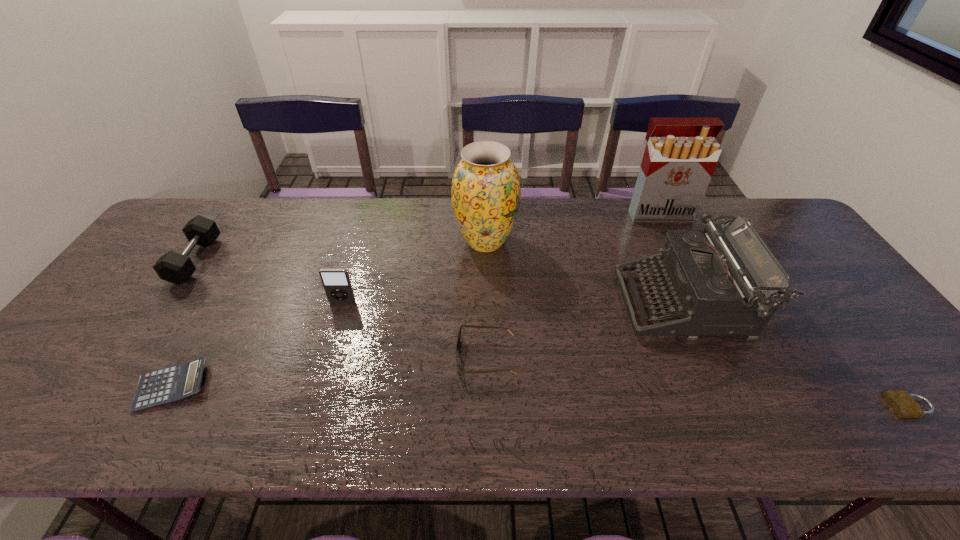
This screenshot has width=960, height=540. Identify the location of cigarette case. (681, 154).

Find the location of `vase`. vase is located at coordinates (486, 191).

In order to click on the third tallest object in this screenshot , I will do `click(722, 283)`.

This screenshot has height=540, width=960. Identify the location of iPod. (336, 282).

Find the location of `the third object from left to right`. the third object from left to right is located at coordinates (336, 282).

Identify the location of the fifth tallest object. This screenshot has height=540, width=960. (173, 267).

This screenshot has width=960, height=540. I want to click on the leftmost object, so [173, 267].

Locate an element on the screen. sunglasses is located at coordinates (476, 326).

Locate an element on the screen. the second shortest object is located at coordinates (174, 383).

At what (x,y) coordinates should I click in order to perform the action: click on calculator. Please return your answer as a coordinate pair (x, y). Image resolution: width=960 pixels, height=540 pixels. Looking at the image, I should click on (174, 383).